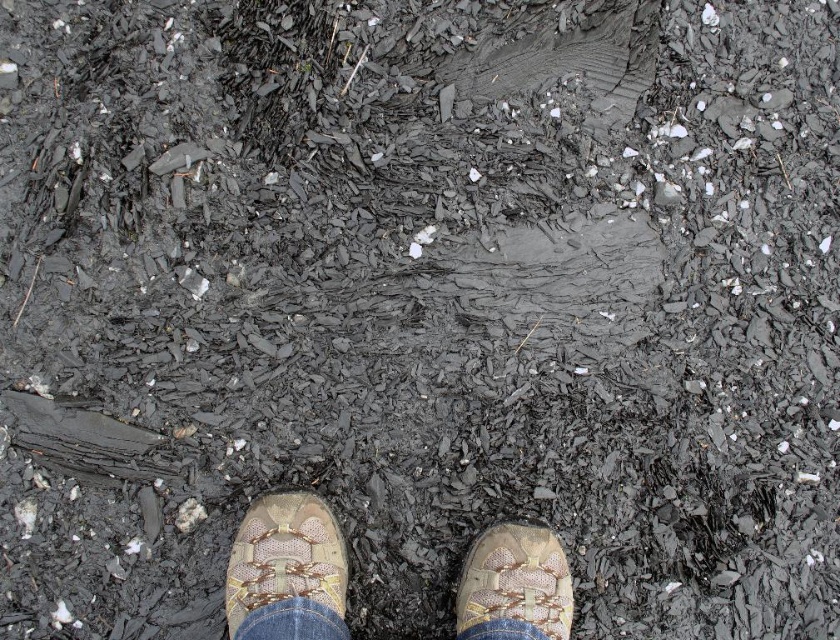
Question: Is tan mesh shoes at center above tan suede shoe at lower center?

Choices:
 (A) yes
 (B) no

Answer: (B)

Question: Which object appears closest to the camera in this image?

Choices:
 (A) tan suede sandal at center
 (B) tan mesh shoes at center
 (C) tan suede shoe at lower center

Answer: (B)

Question: In this image, where is tan suede shoe at lower center located relative to tan suede sandal at center?

Choices:
 (A) below
 (B) above

Answer: (B)

Question: Estimate the real-world distances between objects in this image. Which object is farther from the tan mesh shoes at center?

Choices:
 (A) tan suede sandal at center
 (B) tan suede shoe at lower center

Answer: (A)

Question: Which object is the closest to the tan mesh shoes at center?

Choices:
 (A) tan suede shoe at lower center
 (B) tan suede sandal at center

Answer: (A)

Question: Does tan mesh shoes at center have a smaller size compared to tan suede shoe at lower center?

Choices:
 (A) yes
 (B) no

Answer: (B)